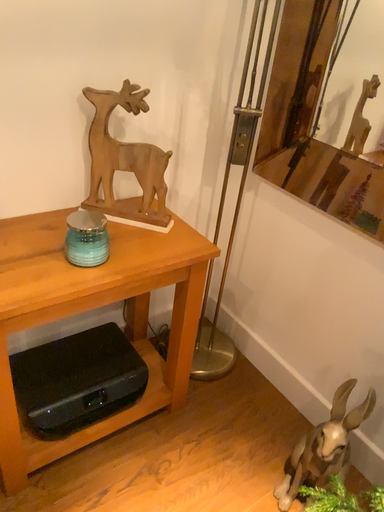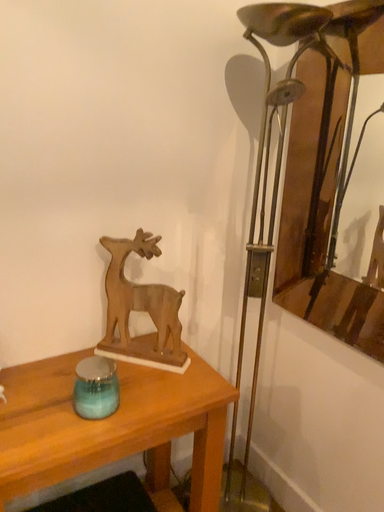
Question: How did the camera likely rotate when shooting the video?

Choices:
 (A) rotated upward
 (B) rotated downward

Answer: (A)